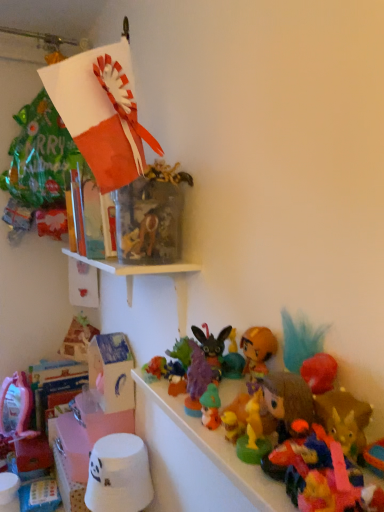
Question: From a real-world perspective, is plush brown bear at center, the second toy in the front-to-back sequence, positioned under pink fabric doll at lower left, the first toy positioned from the back, based on gravity?

Choices:
 (A) no
 (B) yes

Answer: (A)

Question: Does plush brown bear at center, the 9th toy in the left-to-right sequence, appear on the left side of pink fabric doll at lower left, the eleventh toy viewed from the right?

Choices:
 (A) no
 (B) yes

Answer: (A)

Question: Is plush brown bear at center, arranged as the 3th toy when viewed from the right, turned away from pink fabric doll at lower left, marked as the first toy in a left-to-right arrangement?

Choices:
 (A) no
 (B) yes

Answer: (A)

Question: Considering the relative sizes of plush brown bear at center, the 9th toy in the left-to-right sequence, and pink fabric doll at lower left, the eleventh toy in the front-to-back sequence, in the image provided, is plush brown bear at center, the 9th toy in the left-to-right sequence, bigger than pink fabric doll at lower left, the eleventh toy in the front-to-back sequence,?

Choices:
 (A) no
 (B) yes

Answer: (A)

Question: Is plush brown bear at center, arranged as the 10th toy when viewed from the back, positioned in front of pink fabric doll at lower left, the first toy positioned from the back?

Choices:
 (A) no
 (B) yes

Answer: (B)

Question: In terms of size, does white matte bucket at lower left, arranged as the tenth toy when viewed from the front, appear bigger or smaller than purple felt plush at center, placed as the seventh toy when sorted from right to left?

Choices:
 (A) small
 (B) big

Answer: (B)

Question: From a real-world perspective, is white matte bucket at lower left, which is the 10th toy from right to left, above or below purple felt plush at center, positioned as the third toy in back-to-front order?

Choices:
 (A) above
 (B) below

Answer: (B)

Question: Is white matte bucket at lower left, which is the 10th toy from right to left, taller or shorter than purple felt plush at center, the 5th toy from the left?

Choices:
 (A) short
 (B) tall

Answer: (B)

Question: Which is correct: white matte bucket at lower left, which is the 2th toy from back to front, is inside purple felt plush at center, positioned as the third toy in back-to-front order, or outside of it?

Choices:
 (A) outside
 (B) inside

Answer: (A)

Question: From a real-world perspective, relative to white matte bucket at lower left, which is the 10th toy from right to left, is purple felt plush at center, positioned as the 9th toy in front-to-back order, vertically above or below?

Choices:
 (A) above
 (B) below

Answer: (A)

Question: Considering their positions, is purple felt plush at center, positioned as the 9th toy in front-to-back order, located in front of or behind white matte bucket at lower left, arranged as the tenth toy when viewed from the front?

Choices:
 (A) behind
 (B) front

Answer: (B)

Question: Considering the positions of purple felt plush at center, placed as the seventh toy when sorted from right to left, and white matte bucket at lower left, which is the 2th toy from back to front, in the image, is purple felt plush at center, placed as the seventh toy when sorted from right to left, bigger or smaller than white matte bucket at lower left, which is the 2th toy from back to front,?

Choices:
 (A) small
 (B) big

Answer: (A)

Question: Considering the positions of purple felt plush at center, placed as the seventh toy when sorted from right to left, and white matte bucket at lower left, which is the 2th toy from back to front, in the image, is purple felt plush at center, placed as the seventh toy when sorted from right to left, taller or shorter than white matte bucket at lower left, which is the 2th toy from back to front,?

Choices:
 (A) short
 (B) tall

Answer: (A)

Question: In terms of height, does plush multicolored toy at lower right, arranged as the eleventh toy when viewed from the back, look taller or shorter compared to plush brown bear at center, arranged as the 10th toy when viewed from the back?

Choices:
 (A) tall
 (B) short

Answer: (B)

Question: Based on their sizes in the image, would you say plush multicolored toy at lower right, placed as the first toy when sorted from front to back, is bigger or smaller than plush brown bear at center, arranged as the 3th toy when viewed from the right?

Choices:
 (A) big
 (B) small

Answer: (B)